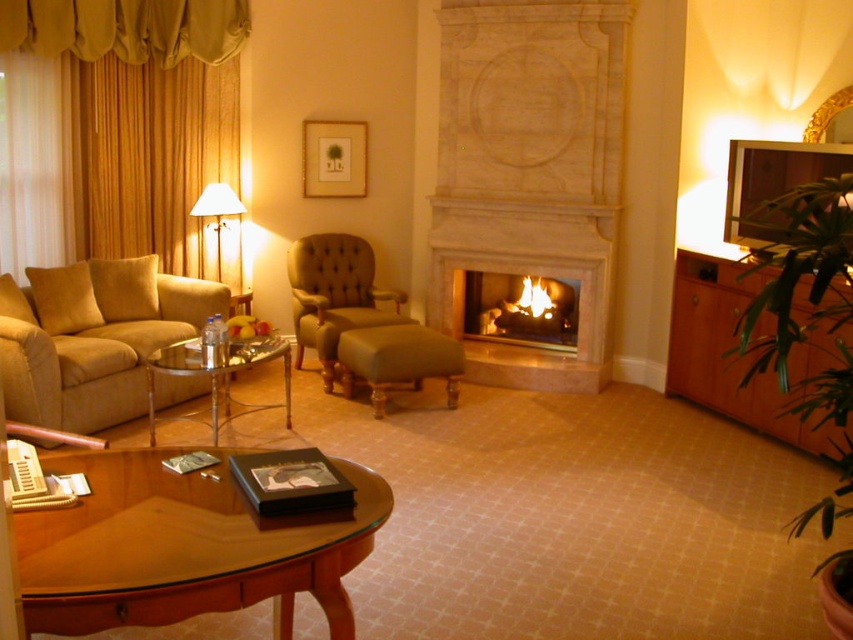
Measure the distance between metallic glass side table at center and matte wood picture frame at upper center.

metallic glass side table at center is 6.86 feet away from matte wood picture frame at upper center.

Is metallic glass side table at center smaller than matte wood picture frame at upper center?

No.

Between point (175, 349) and point (345, 186), which one is positioned behind?

The point (345, 186) is behind.

Where is `metallic glass side table at center`? The width and height of the screenshot is (853, 640). metallic glass side table at center is located at coordinates (218, 376).

Which is more to the left, matte green armchair at center or metallic glass side table at center?

metallic glass side table at center is more to the left.

Can you confirm if matte green armchair at center is positioned above metallic glass side table at center?

Yes, matte green armchair at center is above metallic glass side table at center.

Who is more forward, (299,353) or (242,353)?

Point (242,353)

Locate an element on the screen. Image resolution: width=853 pixels, height=640 pixels. matte green armchair at center is located at coordinates (335, 296).

Is brown wood table at lower left thinner than matte green armchair at center?

Incorrect, brown wood table at lower left's width is not less than matte green armchair at center's.

Who is taller, brown wood table at lower left or matte green armchair at center?

matte green armchair at center

Who is more distant from viewer, (200, 600) or (338, 292)?

Positioned behind is point (338, 292).

This screenshot has height=640, width=853. Find the location of `brown wood table at lower left`. brown wood table at lower left is located at coordinates (184, 547).